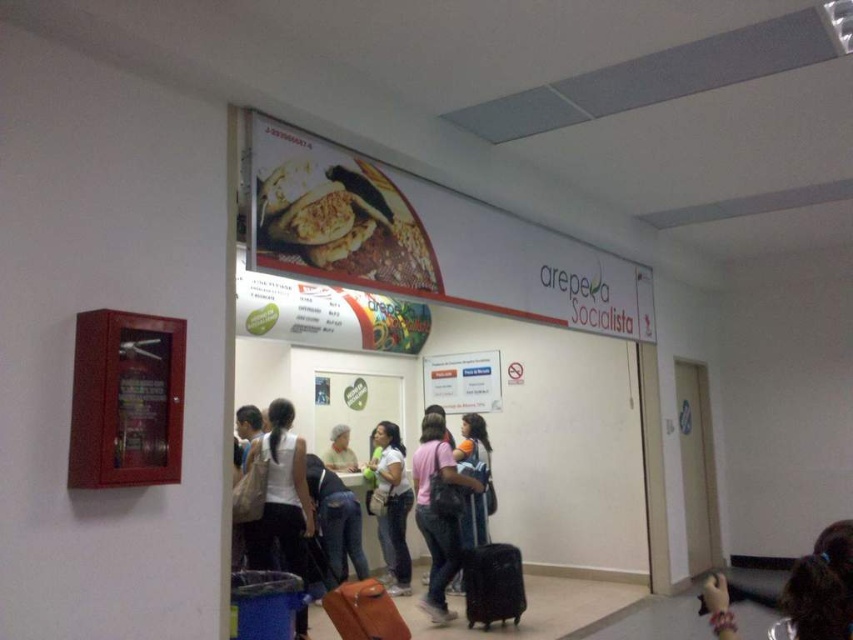
Question: Does matte brown bread at upper center appear on the right side of denim jacket at center?

Choices:
 (A) yes
 (B) no

Answer: (B)

Question: Estimate the real-world distances between objects in this image. Which object is closer to the matte brown bread at upper center?

Choices:
 (A) denim jacket at center
 (B) white fabric bag at lower center
 (C) jeans at center
 (D) matte white shirt at center

Answer: (B)

Question: Is matte plastic signboard at upper center thinner than matte brown bread at upper center?

Choices:
 (A) yes
 (B) no

Answer: (B)

Question: Among these points, which one is farthest from the camera?

Choices:
 (A) (483, 545)
 (B) (358, 528)
 (C) (426, 282)

Answer: (B)

Question: Does black matte suitcase at lower center appear on the left side of jeans at center?

Choices:
 (A) yes
 (B) no

Answer: (B)

Question: Which object appears closest to the camera in this image?

Choices:
 (A) matte plastic signboard at upper center
 (B) black matte suitcase at lower center
 (C) denim jacket at center
 (D) orange fabric backpack at center

Answer: (A)